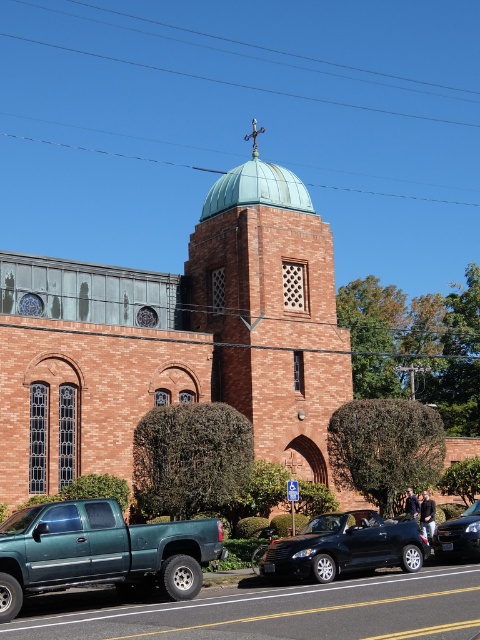
You are standing in front of the church and see two points marked on the building. The first point is at coordinates point [48,566] and the second is at point [342,524]. Which point is closer to you?

Point [48,566] is in front of point [342,524], so the first point is closer to you.

You are a photographer planning to take a photo of the teal brick tower at center and the teal matte truck at lower left. You want to ensure both are in frame. Given that your camera has a fixed focal length, which object should you position closer to the camera to make them appear similar in size?

Since the teal brick tower at center is wider than the teal matte truck at lower left, you should position the teal brick tower at center farther from the camera and the teal matte truck at lower left closer to the camera. This way, their apparent sizes in the photo will be more balanced.